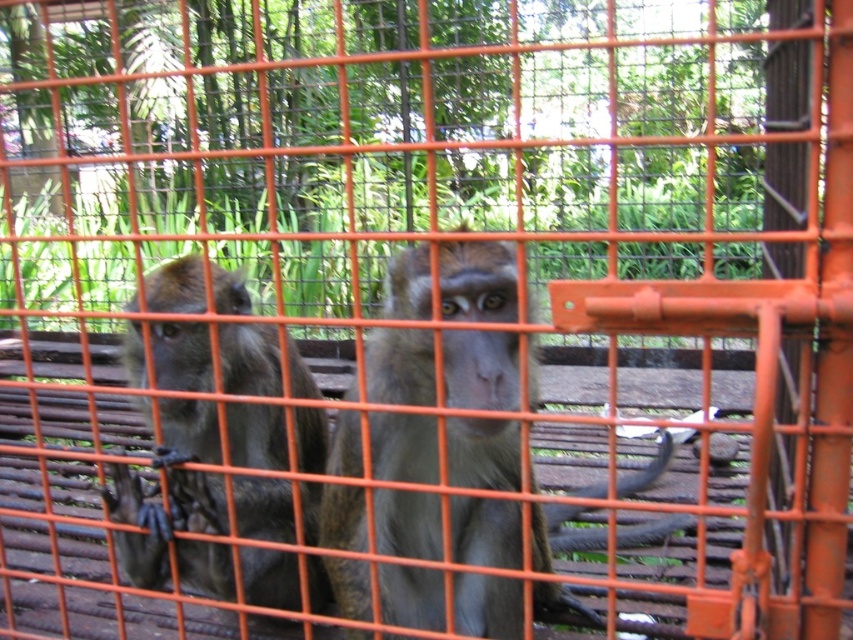
You are a zookeeper observing the monkeys in their cage. You notice the gray fur monkey at center and the shiny brown fur at left. Which monkey is positioned higher in the cage?

The gray fur monkey at center is positioned higher than the shiny brown fur at left in the cage.

Looking at this image, you are a zookeeper who needs to feed two monkeys in a cage. The cage has a feeding slot that is 1 meter wide. The gray fur monkey at center and another monkey are positioned in the cage. Can both monkeys reach the feeding slot at the same time if they move towards it?

The gray fur monkey at center and the other monkey are 1.01 meters apart. Since the feeding slot is only 1 meter wide, they cannot both reach it simultaneously as the distance between them exceeds the slot width.